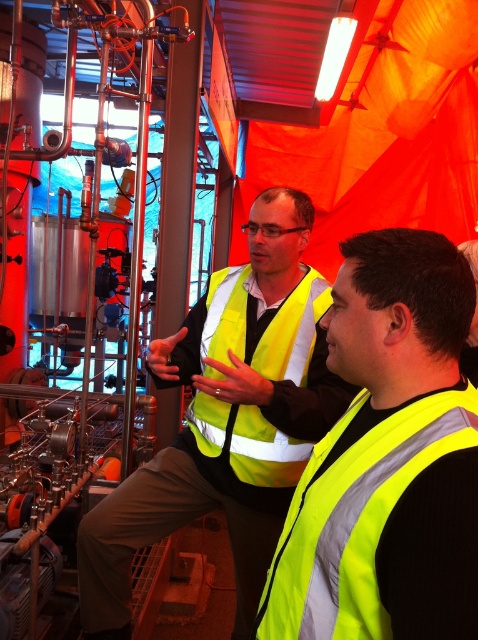
Is point (447, 552) closer to camera compared to point (203, 333)?

Yes, it is.

Image resolution: width=478 pixels, height=640 pixels. What do you see at coordinates (377, 525) in the screenshot?
I see `neon yellow reflective vest at center` at bounding box center [377, 525].

Measure the distance between point (467, 458) and camera.

The distance of point (467, 458) from camera is 32.18 inches.

Where is `neon yellow reflective vest at center`? The width and height of the screenshot is (478, 640). neon yellow reflective vest at center is located at coordinates [x=377, y=525].

Between yellow reflective vest at center and neon yellow reflective vest at center, which one has more height?

yellow reflective vest at center is taller.

Is yellow reflective vest at center positioned behind neon yellow reflective vest at center?

That is True.

Does point (217, 458) come farther from viewer compared to point (432, 566)?

Yes, point (217, 458) is farther from viewer.

Image resolution: width=478 pixels, height=640 pixels. I want to click on yellow reflective vest at center, so click(x=227, y=419).

Is point (313, 317) less distant than point (249, 481)?

No, (313, 317) is behind (249, 481).

What do you see at coordinates (227, 419) in the screenshot?
I see `yellow reflective vest at center` at bounding box center [227, 419].

Between point (343, 385) and point (325, 280), which one is positioned in front?

Point (343, 385) is in front.

At what (x,y) coordinates should I click in order to perform the action: click on yellow reflective vest at center. Please return your answer as a coordinate pair (x, y). The image size is (478, 640). Looking at the image, I should click on (227, 419).